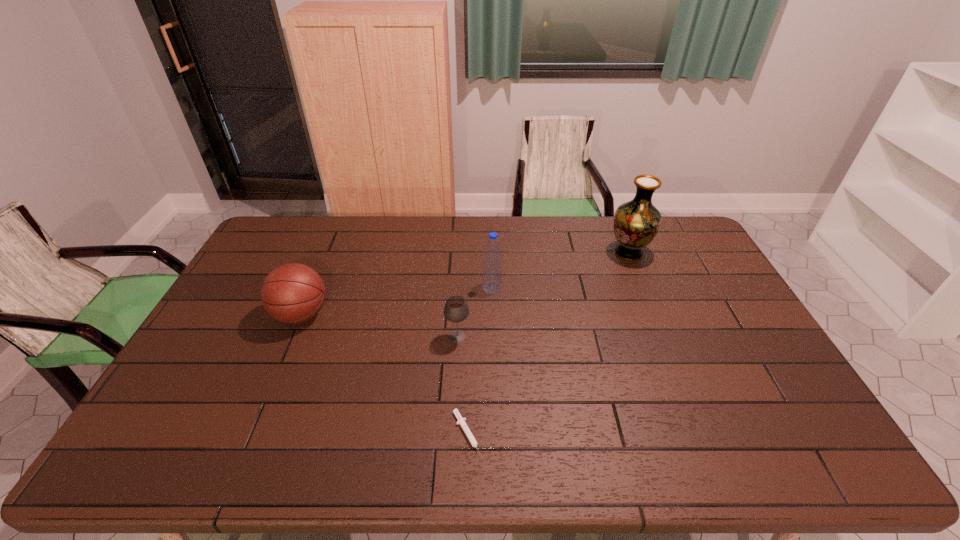
Locate an element on the screen. Image resolution: width=960 pixels, height=540 pixels. unoccupied position between the nearest object and the basketball is located at coordinates (385, 375).

The image size is (960, 540). In order to click on unoccupied area between the wineglass and the nearest object in this screenshot , I will do `click(463, 386)`.

Where is `free space between the wineglass and the fourth object from left to right`? The width and height of the screenshot is (960, 540). free space between the wineglass and the fourth object from left to right is located at coordinates (475, 312).

This screenshot has height=540, width=960. In order to click on free space between the third shortest object and the water bottle in this screenshot , I will do `click(396, 301)`.

The image size is (960, 540). What are the coordinates of `free spot between the rightmost object and the wineglass` in the screenshot? It's located at (543, 295).

Find the location of a particular element. vacant space that is in between the leftmost object and the rightmost object is located at coordinates (465, 284).

The image size is (960, 540). What are the coordinates of `empty space that is in between the leftmost object and the shortest object` in the screenshot? It's located at (385, 375).

You are a GUI agent. You are given a task and a screenshot of the screen. Output one action in this format:
    pyautogui.click(x=<x>, y=<y>)
    Task: Click on the vacant area that lies between the leftmost object and the nearest object
    The image size is (960, 540).
    Given the screenshot: What is the action you would take?
    pyautogui.click(x=385, y=375)

Find the location of a particular element. This screenshot has width=960, height=540. free space that is in between the shortest object and the tallest object is located at coordinates (548, 344).

Locate an element on the screen. The width and height of the screenshot is (960, 540). vacant area that lies between the tallest object and the basketball is located at coordinates (465, 284).